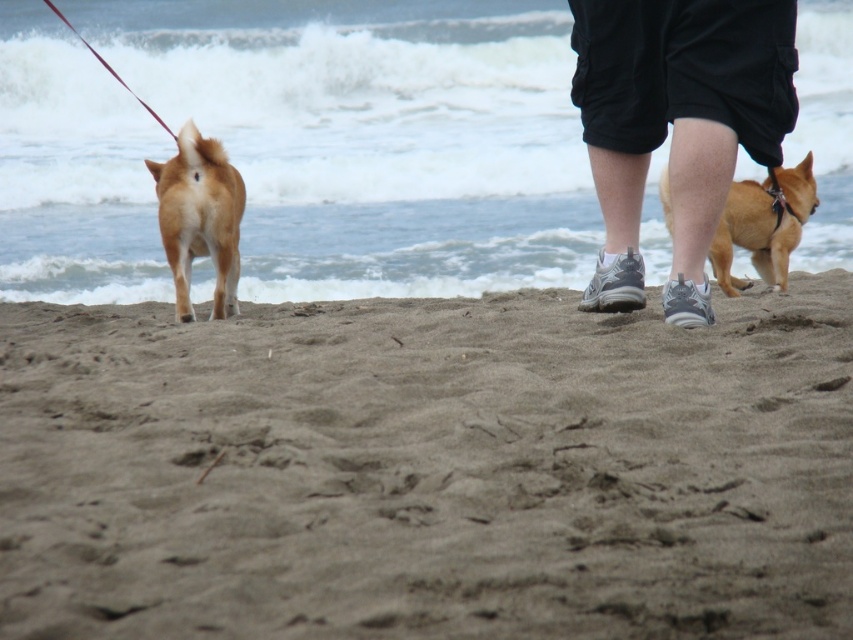
You are a photographer trying to capture a photo of the golden fur dog at right and the black cotton shorts at center. Since you want to focus on the smaller object, which one should you zoom in on?

The black cotton shorts at center has a smaller size compared to the golden fur dog at right, so you should zoom in on the black cotton shorts at center to focus on the smaller object.

You are a person standing on the brown sandy beach at lower center and looking up at the black cotton shorts at center. Which one is higher in position?

The black cotton shorts at center is higher than the brown sandy beach at lower center because the brown sandy beach at lower center is not as tall as the black cotton shorts at center.

You are a photographer standing on the brown sandy beach at lower center and want to take a photo of the black cotton shorts at center. Which direction should you move to get the shorts in your shot?

The brown sandy beach at lower center is positioned under the black cotton shorts at center, so you should move forward to get the black cotton shorts at center into your shot.